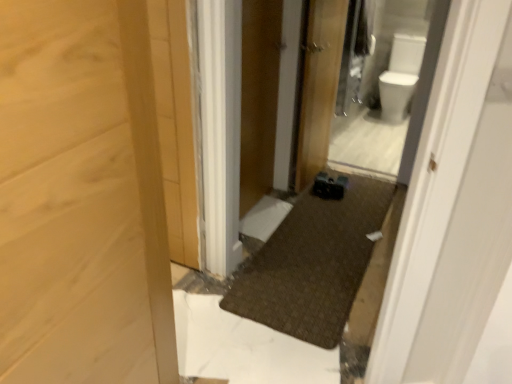
Question: Is wooden door at center aimed at white glossy toilet bowl at upper right?

Choices:
 (A) no
 (B) yes

Answer: (A)

Question: Is wooden door at center turned away from white glossy toilet bowl at upper right?

Choices:
 (A) no
 (B) yes

Answer: (A)

Question: Can you confirm if wooden door at center is shorter than white glossy toilet bowl at upper right?

Choices:
 (A) no
 (B) yes

Answer: (A)

Question: Can you confirm if wooden door at center is thinner than white glossy toilet bowl at upper right?

Choices:
 (A) no
 (B) yes

Answer: (B)

Question: From a real-world perspective, is wooden door at center positioned under white glossy toilet bowl at upper right based on gravity?

Choices:
 (A) yes
 (B) no

Answer: (B)

Question: Is wooden door at center bigger than white glossy toilet bowl at upper right?

Choices:
 (A) yes
 (B) no

Answer: (B)

Question: Does wooden screen door at center have a larger size compared to white glossy toilet bowl at upper right?

Choices:
 (A) yes
 (B) no

Answer: (B)

Question: From a real-world perspective, does wooden screen door at center sit lower than white glossy toilet bowl at upper right?

Choices:
 (A) no
 (B) yes

Answer: (A)

Question: Can you confirm if wooden screen door at center is positioned to the right of white glossy toilet bowl at upper right?

Choices:
 (A) no
 (B) yes

Answer: (A)

Question: Can you confirm if wooden screen door at center is positioned to the left of white glossy toilet bowl at upper right?

Choices:
 (A) no
 (B) yes

Answer: (B)

Question: Considering the relative sizes of wooden screen door at center and white glossy toilet bowl at upper right in the image provided, is wooden screen door at center wider than white glossy toilet bowl at upper right?

Choices:
 (A) yes
 (B) no

Answer: (B)

Question: Is wooden screen door at center facing towards white glossy toilet bowl at upper right?

Choices:
 (A) yes
 (B) no

Answer: (B)

Question: Is white glossy toilet bowl at upper right positioned before wooden door at center?

Choices:
 (A) yes
 (B) no

Answer: (B)